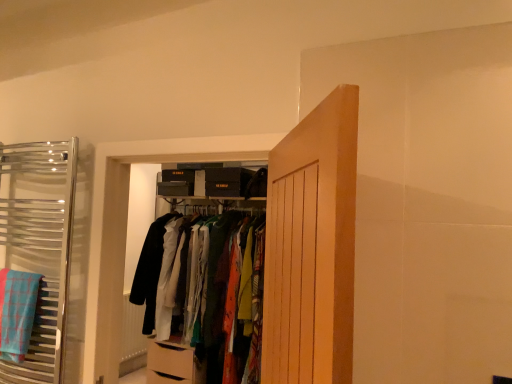
Question: Relative to wooden door at center, is blue plaid bath towel at left in front or behind?

Choices:
 (A) front
 (B) behind

Answer: (B)

Question: From the image's perspective, is blue plaid bath towel at left positioned above or below wooden door at center?

Choices:
 (A) below
 (B) above

Answer: (A)

Question: Which object is positioned farthest from the blue plaid bath towel at left?

Choices:
 (A) chrome towel rack at left, the second closet positioned from the right
 (B) wooden door at center
 (C) matte fabric clothes at center, the 2th closet when ordered from front to back

Answer: (B)

Question: Estimate the real-world distances between objects in this image. Which object is closer to the blue plaid bath towel at left?

Choices:
 (A) chrome towel rack at left, acting as the second closet starting from the back
 (B) matte fabric clothes at center, which is counted as the 1th closet, starting from the right
 (C) wooden door at center

Answer: (A)